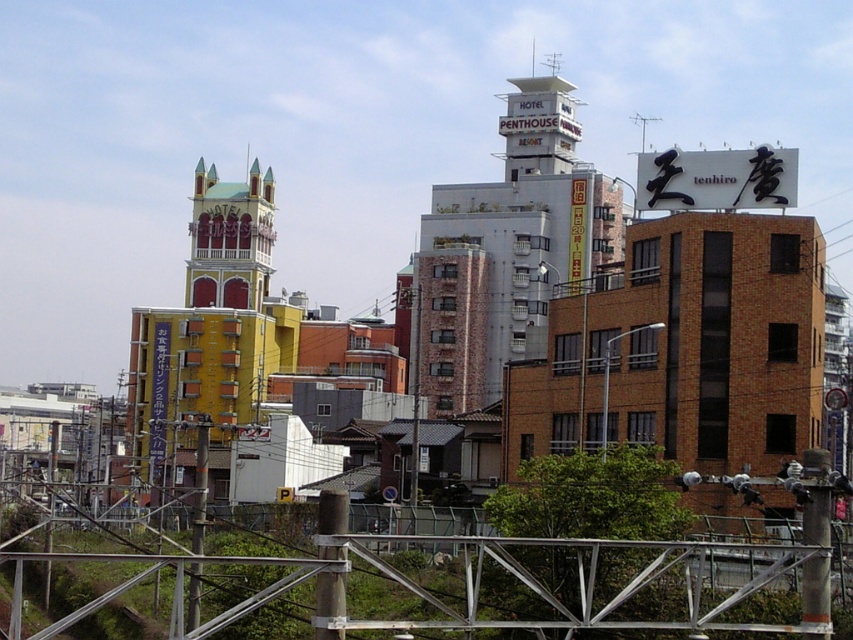
You are a tourist in this urban area and want to take a photo of both the white brick building at center and the yellow matte building at center. Since you want both in the frame, can you adjust your position so that neither building blocks the other?

The yellow matte building at center is behind the white brick building at center, so you can move to the side to capture both without one blocking the other.

You are standing at the bottom of the image and want to place a small decorative plant exactly where the metallic gray rail at bottom is located. What are the coordinates where you should place the plant?

You should place the plant at coordinates point [428,586] where the metallic gray rail at bottom is located.

You are a pedestrian standing at the bottom of the image. You want to walk towards the white brick building at center. Is the metallic gray rail at bottom blocking your path?

The metallic gray rail at bottom is in front of the white brick building at center, so it is blocking your path.